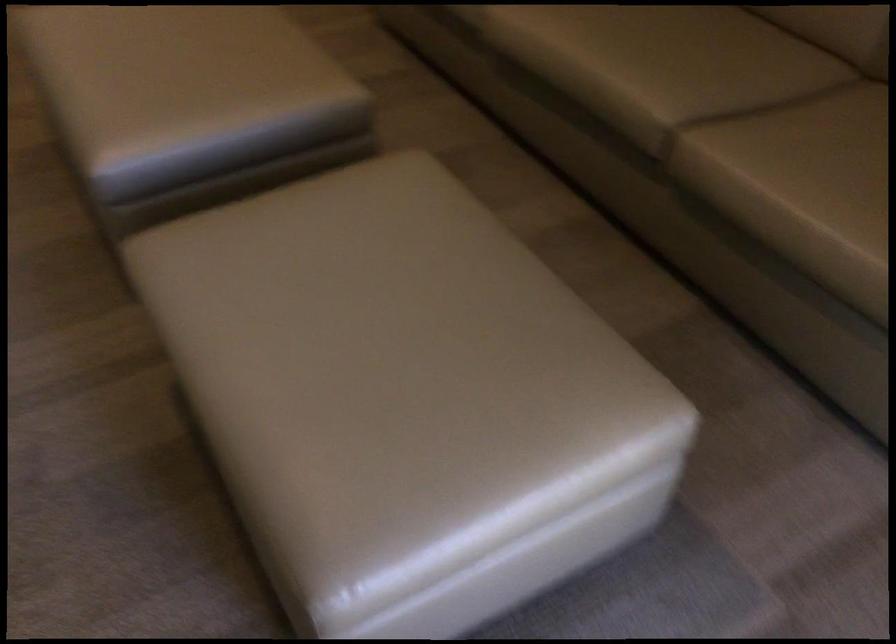
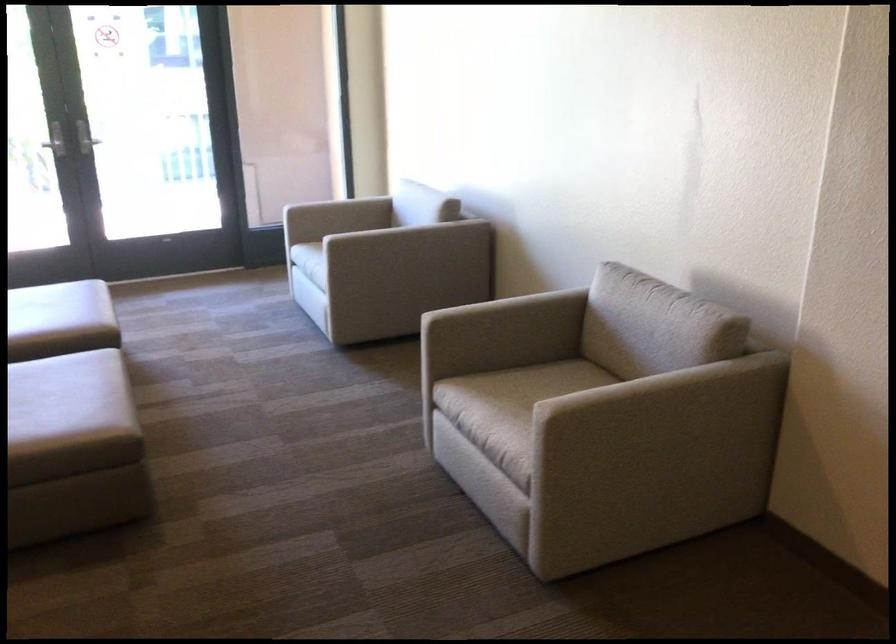
The point at (268,310) is marked in the first image. Where is the corresponding point in the second image?

(58, 308)